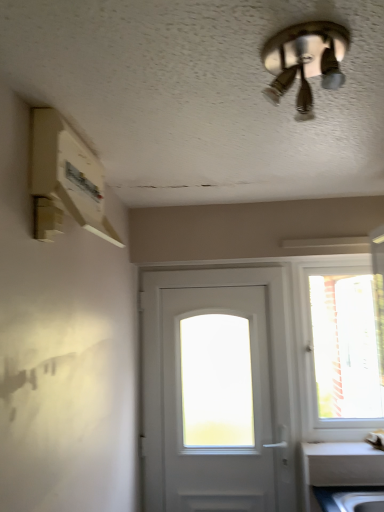
Question: From the image's perspective, is transparent glass window at right located above or below white matte door at center?

Choices:
 (A) below
 (B) above

Answer: (B)

Question: Is transparent glass window at right taller or shorter than white matte door at center?

Choices:
 (A) short
 (B) tall

Answer: (A)

Question: Which object is the farthest from the metallic silver ceiling fan at upper center?

Choices:
 (A) white matte door at center
 (B) transparent glass window at right

Answer: (B)

Question: Which object is the closest to the white matte door at center?

Choices:
 (A) metallic silver ceiling fan at upper center
 (B) transparent glass window at right

Answer: (A)